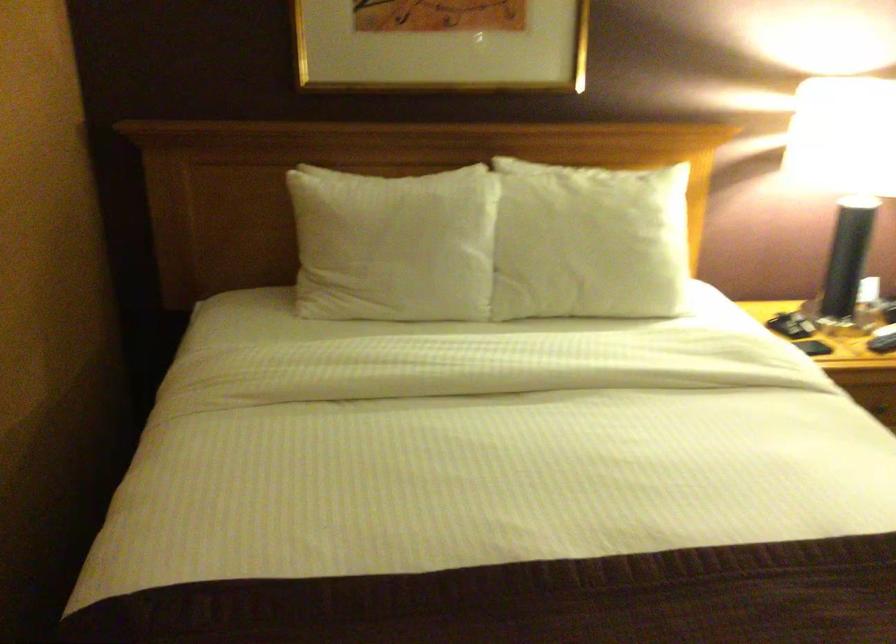
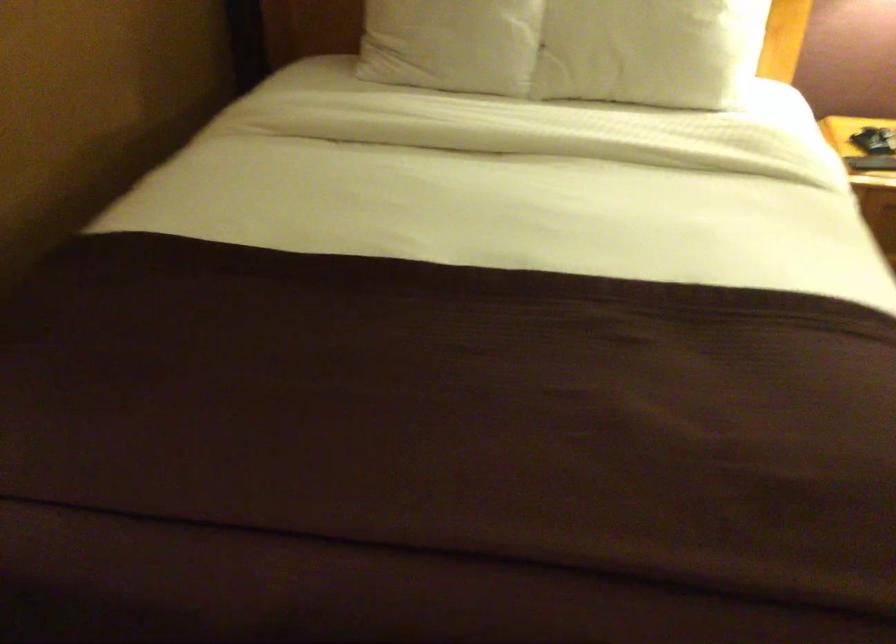
In the second image, find the point that corresponds to pixel 405 276 in the first image.

(452, 44)